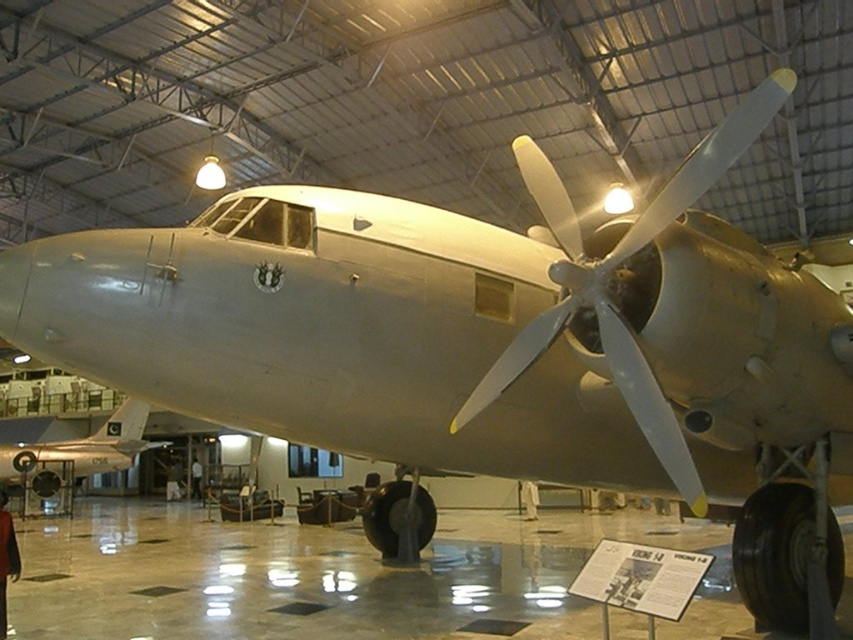
Does metallic silver propeller at center have a smaller size compared to brown fabric bag at center?

Incorrect, metallic silver propeller at center is not smaller in size than brown fabric bag at center.

Between point (679, 176) and point (166, 480), which one is positioned behind?

The point (166, 480) is behind.

Locate an element on the screen. The image size is (853, 640). metallic silver propeller at center is located at coordinates (612, 276).

Find the location of a particular element. This screenshot has width=853, height=640. metallic silver propeller at center is located at coordinates 612,276.

Who is shorter, metallic silver propeller at center or dark brown leather jacket at lower left?

Standing shorter between the two is metallic silver propeller at center.

Can you confirm if metallic silver propeller at center is taller than dark brown leather jacket at lower left?

Incorrect, metallic silver propeller at center's height is not larger of dark brown leather jacket at lower left's.

The height and width of the screenshot is (640, 853). What do you see at coordinates (612, 276) in the screenshot?
I see `metallic silver propeller at center` at bounding box center [612, 276].

The image size is (853, 640). Identify the location of metallic silver propeller at center. (612, 276).

From the picture: Does metallic silver airplane at lower left have a greater height compared to brown fabric bag at center?

No.

What do you see at coordinates (85, 445) in the screenshot? I see `metallic silver airplane at lower left` at bounding box center [85, 445].

Where is `metallic silver airplane at lower left`? metallic silver airplane at lower left is located at coordinates (85, 445).